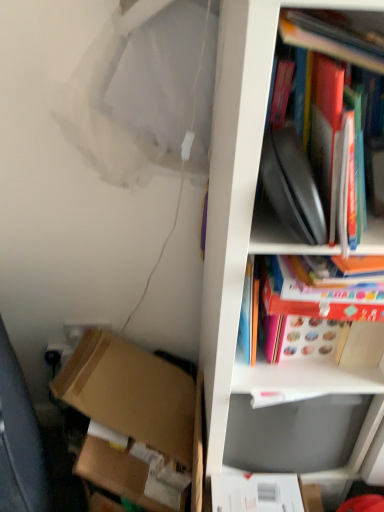
You are a GUI agent. You are given a task and a screenshot of the screen. Output one action in this format:
    pyautogui.click(x=<x>, y=<y>)
    Task: Click on the hardcover book at upper right, positioned as the first book in top-to-bottom order
    
    Given the screenshot: What is the action you would take?
    pyautogui.click(x=310, y=163)

The width and height of the screenshot is (384, 512). What do you see at coordinates (136, 398) in the screenshot?
I see `brown cardboard box at lower left` at bounding box center [136, 398].

I want to click on hardcover book at upper right, arranged as the 2th book when ordered from the bottom, so click(310, 163).

Is white matte cabinet at right located outside matte red book at upper right, which appears as the first book when ordered from the bottom?

Indeed, white matte cabinet at right is completely outside matte red book at upper right, which appears as the first book when ordered from the bottom.

Can you confirm if white matte cabinet at right is shorter than matte red book at upper right, the 2th book positioned from the top?

Incorrect, the height of white matte cabinet at right does not fall short of that of matte red book at upper right, the 2th book positioned from the top.

Is white matte cabinet at right wider or thinner than matte red book at upper right, the 2th book positioned from the top?

Clearly, white matte cabinet at right has more width compared to matte red book at upper right, the 2th book positioned from the top.

Is white matte cabinet at right positioned with its back to matte red book at upper right, the 2th book positioned from the top?

That's right, white matte cabinet at right is facing away from matte red book at upper right, the 2th book positioned from the top.

Which of these two, matte red book at upper right, which appears as the first book when ordered from the bottom, or brown cardboard box at lower left, is thinner?

matte red book at upper right, which appears as the first book when ordered from the bottom, is thinner.

Is brown cardboard box at lower left at the back of matte red book at upper right, the 2th book positioned from the top?

matte red book at upper right, the 2th book positioned from the top, is not turned away from brown cardboard box at lower left.

Considering the positions of point (312, 318) and point (142, 372), is point (312, 318) closer or farther from the camera than point (142, 372)?

Point (312, 318) is closer to the camera than point (142, 372).

Relative to brown cardboard box at lower left, is matte red book at upper right, the 2th book positioned from the top, in front or behind?

Visually, matte red book at upper right, the 2th book positioned from the top, is located in front of brown cardboard box at lower left.

Between brown cardboard box at lower left and matte red book at upper right, the 2th book positioned from the top, which one has less height?

Standing shorter between the two is matte red book at upper right, the 2th book positioned from the top.

From a real-world perspective, is brown cardboard box at lower left physically located above or below matte red book at upper right, which appears as the first book when ordered from the bottom?

Clearly, from a real-world perspective, brown cardboard box at lower left is below matte red book at upper right, which appears as the first book when ordered from the bottom.

From the image's perspective, between brown cardboard box at lower left and matte red book at upper right, the 2th book positioned from the top, which one is located above?

From the image's view, matte red book at upper right, the 2th book positioned from the top, is above.

Considering the sizes of objects brown cardboard box at lower left and matte red book at upper right, the 2th book positioned from the top, in the image provided, who is bigger, brown cardboard box at lower left or matte red book at upper right, the 2th book positioned from the top,?

With larger size is brown cardboard box at lower left.

Based on the photo, which object is further away from the camera taking this photo, brown cardboard box at lower left or white matte cabinet at right?

brown cardboard box at lower left is more distant.

Considering the relative positions of brown cardboard box at lower left and white matte cabinet at right in the image provided, is brown cardboard box at lower left to the left or to the right of white matte cabinet at right?

brown cardboard box at lower left is positioned on white matte cabinet at right's left side.

Is brown cardboard box at lower left thinner than white matte cabinet at right?

Yes, brown cardboard box at lower left is thinner than white matte cabinet at right.

Who is bigger, brown cardboard box at lower left or white matte cabinet at right?

white matte cabinet at right.

Is point (316, 110) less distant than point (198, 495)?

That is True.

From the image's perspective, is hardcover book at upper right, positioned as the first book in top-to-bottom order, on top of brown cardboard box at lower left?

Yes, from the image's perspective, hardcover book at upper right, positioned as the first book in top-to-bottom order, is above brown cardboard box at lower left.

Measure the distance between hardcover book at upper right, arranged as the 2th book when ordered from the bottom, and matte red book at upper right, which appears as the first book when ordered from the bottom.

The distance of hardcover book at upper right, arranged as the 2th book when ordered from the bottom, from matte red book at upper right, which appears as the first book when ordered from the bottom, is 8.55 inches.

Is hardcover book at upper right, arranged as the 2th book when ordered from the bottom, aimed at matte red book at upper right, which appears as the first book when ordered from the bottom?

No, hardcover book at upper right, arranged as the 2th book when ordered from the bottom, is not aimed at matte red book at upper right, which appears as the first book when ordered from the bottom.

From the image's perspective, does hardcover book at upper right, positioned as the first book in top-to-bottom order, appear lower than matte red book at upper right, which appears as the first book when ordered from the bottom?

No.

Is hardcover book at upper right, arranged as the 2th book when ordered from the bottom, positioned behind matte red book at upper right, which appears as the first book when ordered from the bottom?

No.

Is white matte cabinet at right far away from hardcover book at upper right, positioned as the first book in top-to-bottom order?

Actually, white matte cabinet at right and hardcover book at upper right, positioned as the first book in top-to-bottom order, are a little close together.

Is white matte cabinet at right positioned beyond the bounds of hardcover book at upper right, positioned as the first book in top-to-bottom order?

That's correct, white matte cabinet at right is outside of hardcover book at upper right, positioned as the first book in top-to-bottom order.

Relative to hardcover book at upper right, arranged as the 2th book when ordered from the bottom, is white matte cabinet at right in front or behind?

white matte cabinet at right is in front of hardcover book at upper right, arranged as the 2th book when ordered from the bottom.

Is point (239, 22) closer or farther from the camera than point (274, 144)?

Point (239, 22) appears to be closer to the viewer than point (274, 144).

Which book is the 1st one when counting from the left side of the white matte cabinet at right? Please provide its 2D coordinates.

[(318, 321)]

From the brown cardboard box at lower left, count 1st books forward and point to it. Please provide its 2D coordinates.

[(318, 321)]

Based on the photo, estimate the real-world distances between objects in this image. Which object is further from hardcover book at upper right, arranged as the 2th book when ordered from the bottom, brown cardboard box at lower left or matte red book at upper right, which appears as the first book when ordered from the bottom?

Among the two, brown cardboard box at lower left is located further to hardcover book at upper right, arranged as the 2th book when ordered from the bottom.

Considering their positions, is matte red book at upper right, which appears as the first book when ordered from the bottom, positioned closer to white matte cabinet at right than brown cardboard box at lower left?

matte red book at upper right, which appears as the first book when ordered from the bottom, lies closer to white matte cabinet at right than the other object.

Which object lies nearer to the anchor point hardcover book at upper right, arranged as the 2th book when ordered from the bottom, white matte cabinet at right or matte red book at upper right, the 2th book positioned from the top?

white matte cabinet at right is positioned closer to the anchor hardcover book at upper right, arranged as the 2th book when ordered from the bottom.

When comparing their distances from matte red book at upper right, the 2th book positioned from the top, does brown cardboard box at lower left or hardcover book at upper right, positioned as the first book in top-to-bottom order, seem closer?

hardcover book at upper right, positioned as the first book in top-to-bottom order, is positioned closer to the anchor matte red book at upper right, the 2th book positioned from the top.

When comparing their distances from matte red book at upper right, which appears as the first book when ordered from the bottom, does hardcover book at upper right, arranged as the 2th book when ordered from the bottom, or brown cardboard box at lower left seem further?

The object further to matte red book at upper right, which appears as the first book when ordered from the bottom, is brown cardboard box at lower left.

Estimate the real-world distances between objects in this image. Which object is further from white matte cabinet at right, brown cardboard box at lower left or hardcover book at upper right, positioned as the first book in top-to-bottom order?

The object further to white matte cabinet at right is brown cardboard box at lower left.

Which object lies further to the anchor point white matte cabinet at right, hardcover book at upper right, arranged as the 2th book when ordered from the bottom, or matte red book at upper right, the 2th book positioned from the top?

Based on the image, hardcover book at upper right, arranged as the 2th book when ordered from the bottom, appears to be further to white matte cabinet at right.

Considering their positions, is white matte cabinet at right positioned closer to brown cardboard box at lower left than matte red book at upper right, the 2th book positioned from the top?

white matte cabinet at right lies closer to brown cardboard box at lower left than the other object.

Find the location of a particular element. Image resolution: width=384 pixels, height=512 pixels. book between hardcover book at upper right, positioned as the first book in top-to-bottom order, and white matte cabinet at right in the up-down direction is located at coordinates coord(318,321).

The height and width of the screenshot is (512, 384). I want to click on book between hardcover book at upper right, positioned as the first book in top-to-bottom order, and brown cardboard box at lower left in the up-down direction, so click(318, 321).

At what (x,y) coordinates should I click in order to perform the action: click on cabinetry that lies between hardcover book at upper right, arranged as the 2th book when ordered from the bottom, and brown cardboard box at lower left from top to bottom. Please return your answer as a coordinate pair (x, y). The width and height of the screenshot is (384, 512). Looking at the image, I should click on (243, 280).